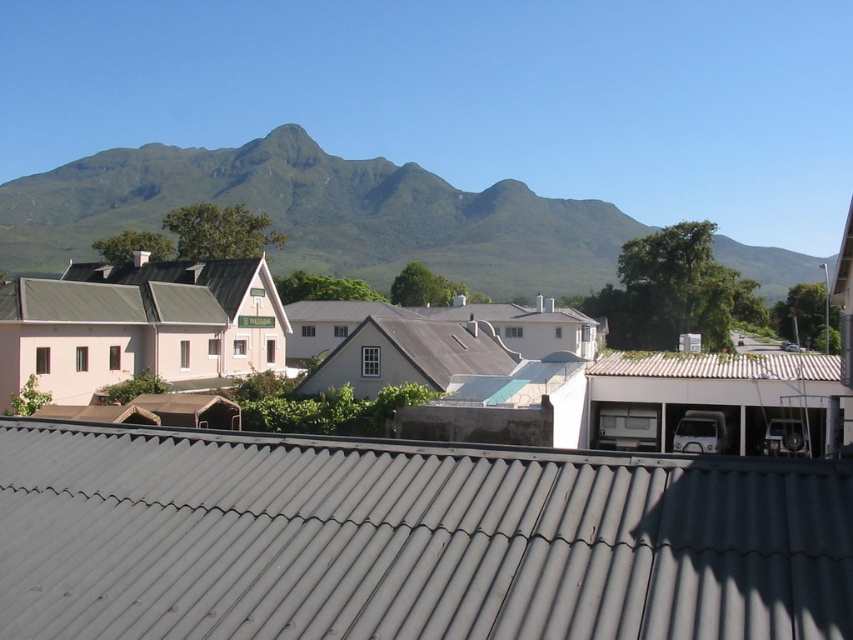
Consider the image. Who is shorter, gray corrugated metal roof at center or metallic corrugated roof at center?

Standing shorter between the two is gray corrugated metal roof at center.

Is gray corrugated metal roof at center positioned behind metallic corrugated roof at center?

No, gray corrugated metal roof at center is closer to the viewer.

This screenshot has width=853, height=640. I want to click on gray corrugated metal roof at center, so click(409, 540).

The width and height of the screenshot is (853, 640). In order to click on gray corrugated metal roof at center in this screenshot , I will do `click(409, 540)`.

Does gray corrugated metal roof at center have a greater width compared to green grassy mountain at upper center?

No.

Is point (737, 493) positioned before point (445, 257)?

Yes, it is in front of point (445, 257).

The image size is (853, 640). I want to click on gray corrugated metal roof at center, so click(409, 540).

Is green grassy mountain at upper center closer to camera compared to metallic corrugated roof at center?

No, green grassy mountain at upper center is further to the viewer.

Which of these two, green grassy mountain at upper center or metallic corrugated roof at center, stands shorter?

With less height is metallic corrugated roof at center.

Between point (263, 202) and point (805, 371), which one is positioned behind?

Positioned behind is point (263, 202).

The height and width of the screenshot is (640, 853). I want to click on green grassy mountain at upper center, so click(322, 214).